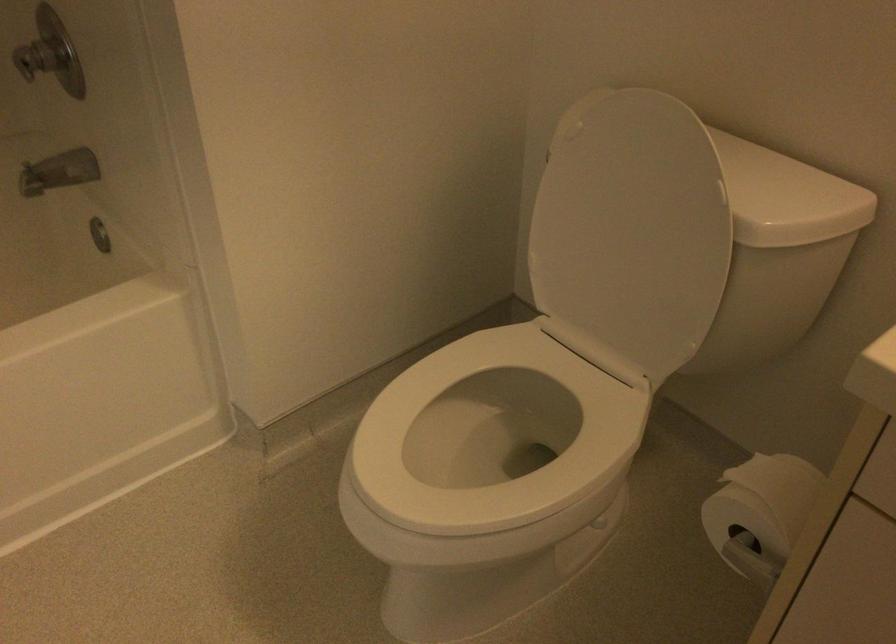
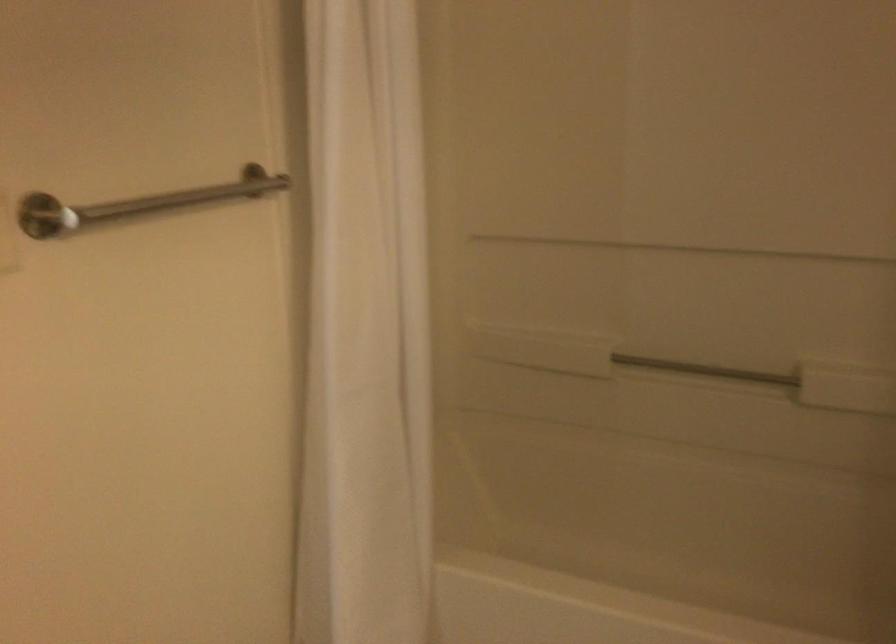
Question: Based on the continuous images, in which direction is the camera rotating? Reply with the corresponding letter.

Choices:
 (A) Left
 (B) Right
 (C) Up
 (D) Down

Answer: (A)